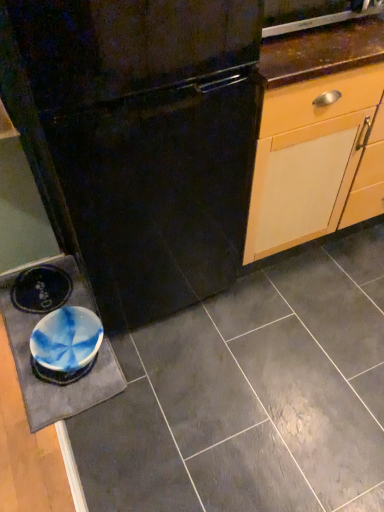
Where is `vacant area located to the right-hand side of black matte refrigerator at center`? vacant area located to the right-hand side of black matte refrigerator at center is located at coordinates (296, 321).